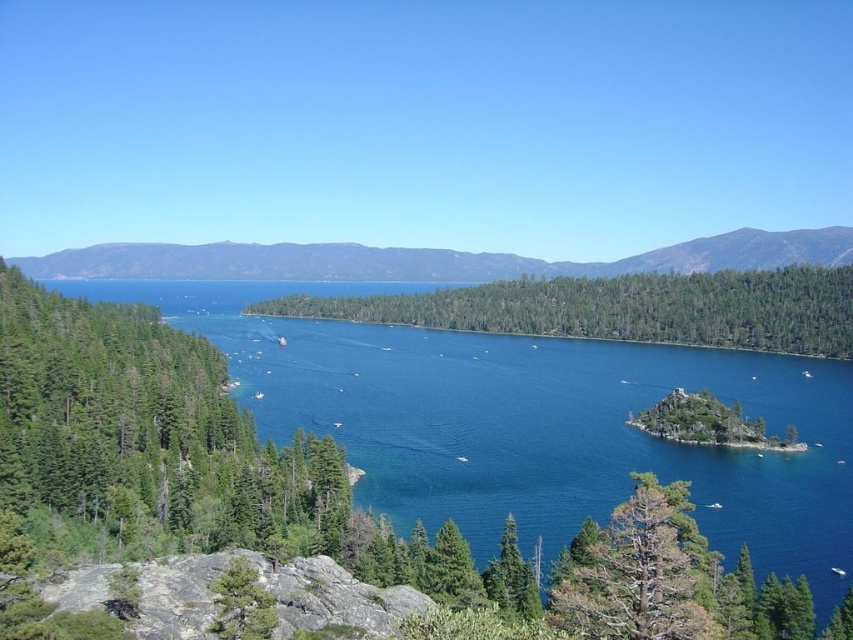
You are standing at the edge of the lake and want to determine which of the two points, point (473, 380) or point (519, 257), is closer to you. Based on the scene, which point is nearer?

Point (473, 380) is closer to the viewer than point (519, 257).

You are standing at the edge of the rocky outcrop in the foreground of the scene. Which direction should you look to see the deep blue water at center?

The deep blue water at center is located at point coordinates, so you should look towards the center of the scene to see it.